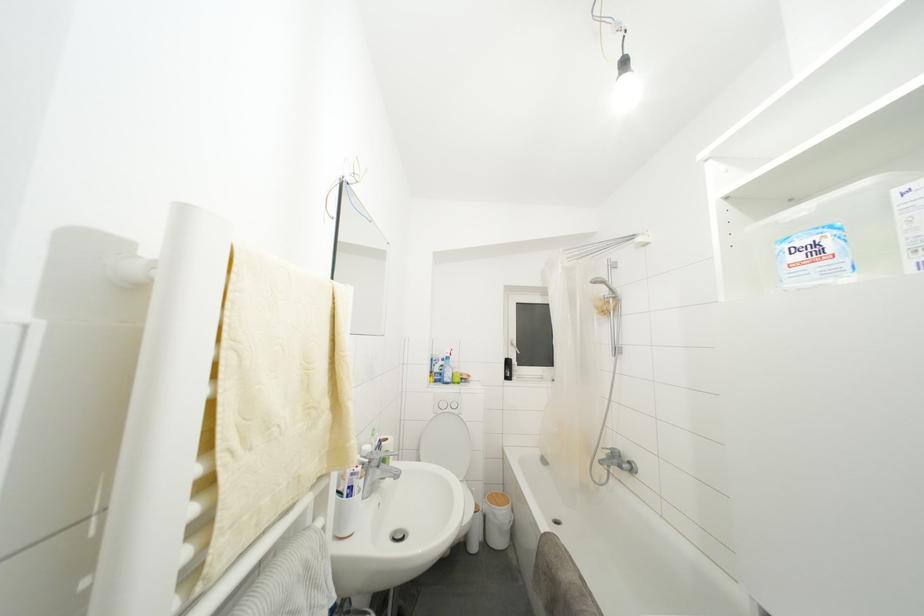
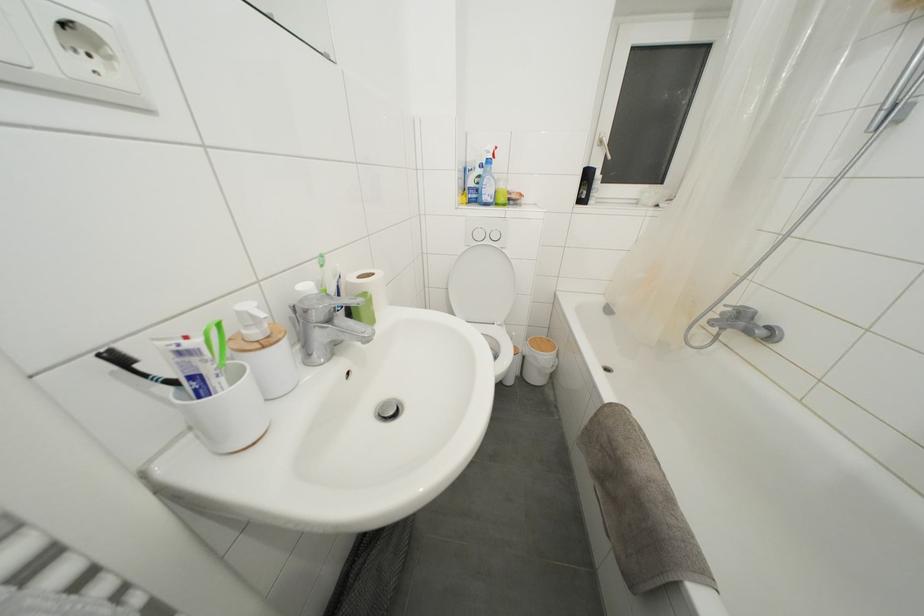
In the second image, find the point that corresponds to point 517,350 in the first image.

(604, 148)